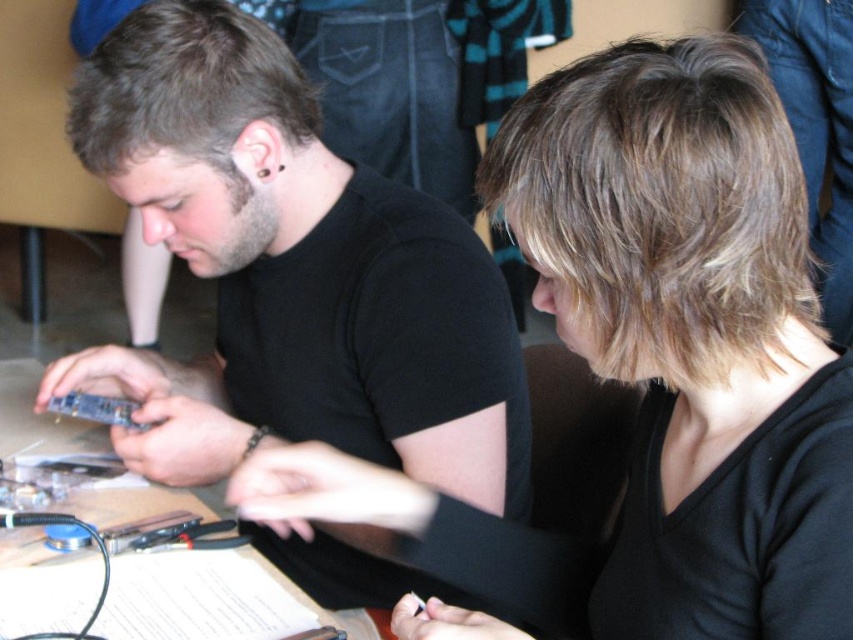
Who is lower down, black matte hair at upper center or blue metallic circuit board at center?

Positioned lower is black matte hair at upper center.

Does point (717, 401) come in front of point (94, 404)?

Yes, point (717, 401) is in front of point (94, 404).

Who is more distant from viewer, (421, 566) or (134, 422)?

The point (134, 422) is behind.

You are a GUI agent. You are given a task and a screenshot of the screen. Output one action in this format:
    pyautogui.click(x=<x>, y=<y>)
    Task: Click on the black matte hair at upper center
    The height and width of the screenshot is (640, 853).
    Given the screenshot: What is the action you would take?
    pyautogui.click(x=647, y=368)

Does matte black shirt at center appear on the left side of wooden table at center?

Incorrect, matte black shirt at center is not on the left side of wooden table at center.

Looking at this image, is matte black shirt at center positioned at the back of wooden table at center?

Yes, matte black shirt at center is further from the viewer.

Between point (293, 369) and point (15, 401), which one is positioned behind?

Positioned behind is point (15, 401).

Where is `matte black shirt at center`? matte black shirt at center is located at coordinates (291, 273).

Does black matte hair at upper center appear over wooden table at center?

Correct, black matte hair at upper center is located above wooden table at center.

Identify the location of black matte hair at upper center. The image size is (853, 640). (647, 368).

The width and height of the screenshot is (853, 640). In order to click on black matte hair at upper center in this screenshot , I will do `click(647, 368)`.